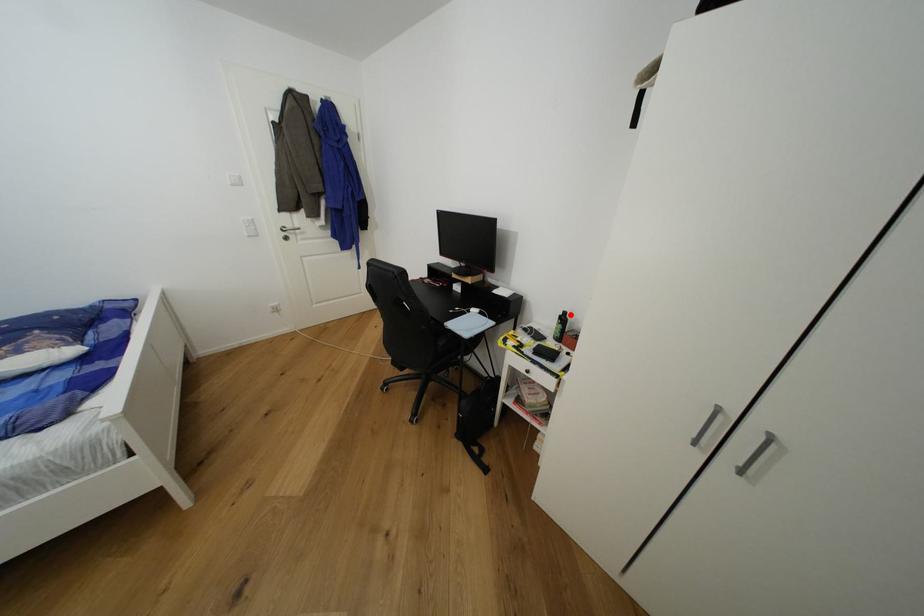
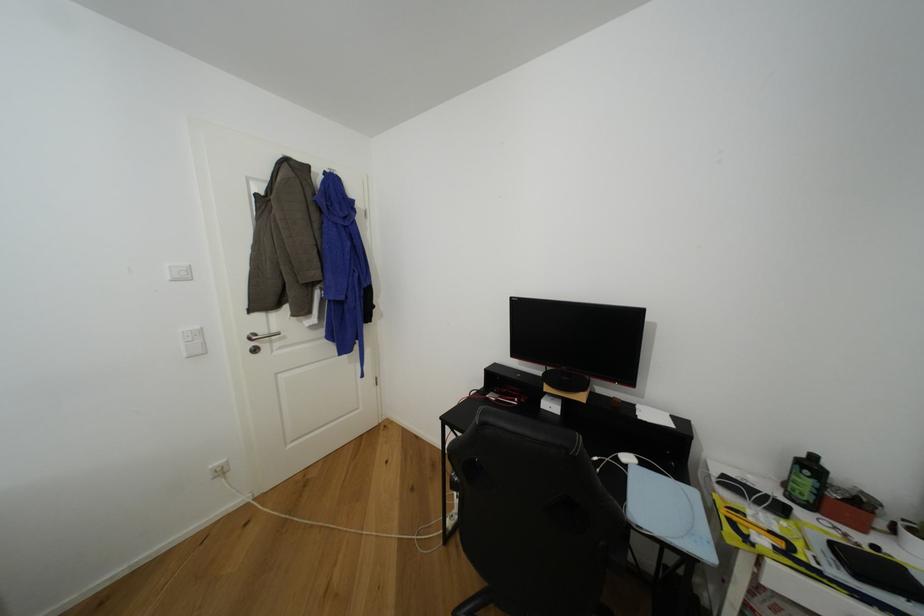
Locate, in the second image, the point that corresponds to the highlighted location in the first image.

(820, 459)